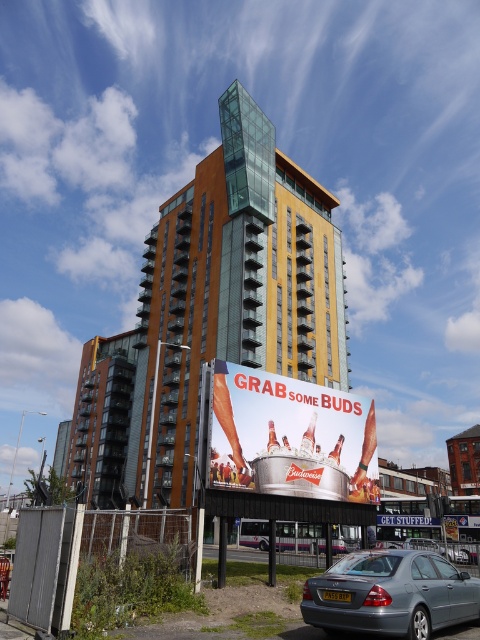
Is metallic silver beer at center wider than metallic silver sign at center?

Yes, metallic silver beer at center is wider than metallic silver sign at center.

Does metallic silver beer at center appear under metallic silver sign at center?

Actually, metallic silver beer at center is above metallic silver sign at center.

Based on the photo, who is more distant from viewer, (330, 401) or (479, 520)?

The point (479, 520) is more distant.

Where is `metallic silver beer at center`? The image size is (480, 640). metallic silver beer at center is located at coordinates (289, 436).

Does metallic silver beer at center have a greater height compared to silver metallic car at lower center?

Yes, metallic silver beer at center is taller than silver metallic car at lower center.

Is the position of metallic silver beer at center more distant than that of silver metallic car at lower center?

No, metallic silver beer at center is closer to the viewer.

Does point (239, 444) come closer to viewer compared to point (411, 538)?

Yes.

Find the location of `metallic silver beer at center`. metallic silver beer at center is located at coordinates (289, 436).

Who is positioned more to the right, metallic silver beer at center or silver metallic sedan at lower center?

silver metallic sedan at lower center is more to the right.

Is metallic silver beer at center below silver metallic sedan at lower center?

No.

Is point (371, 444) more distant than point (462, 547)?

No.

Identify the location of metallic silver beer at center. (289, 436).